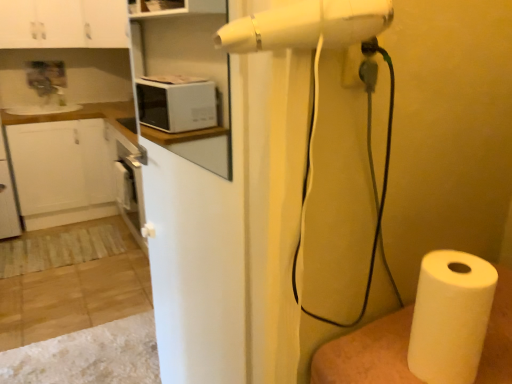
Question: From a real-world perspective, is white matte countertop at left positioned over white paper at lower right based on gravity?

Choices:
 (A) yes
 (B) no

Answer: (B)

Question: Is white matte countertop at left surrounding white paper at lower right?

Choices:
 (A) no
 (B) yes

Answer: (A)

Question: Is white matte countertop at left further to the viewer compared to white paper at lower right?

Choices:
 (A) no
 (B) yes

Answer: (B)

Question: Is white matte countertop at left closer to the viewer compared to white paper at lower right?

Choices:
 (A) yes
 (B) no

Answer: (B)

Question: Considering the relative sizes of white matte countertop at left and white paper at lower right in the image provided, is white matte countertop at left wider than white paper at lower right?

Choices:
 (A) no
 (B) yes

Answer: (A)

Question: Can you confirm if white matte countertop at left is taller than white paper at lower right?

Choices:
 (A) no
 (B) yes

Answer: (B)

Question: Is white matte countertop at left bigger than white glossy cabinet at upper left, which is the first cabinetry in right-to-left order?

Choices:
 (A) yes
 (B) no

Answer: (A)

Question: Could you tell me if white matte countertop at left is facing white glossy cabinet at upper left, arranged as the 2th cabinetry when viewed from the left?

Choices:
 (A) no
 (B) yes

Answer: (A)

Question: Is white matte countertop at left facing away from white glossy cabinet at upper left, arranged as the 2th cabinetry when viewed from the left?

Choices:
 (A) no
 (B) yes

Answer: (A)

Question: Can you confirm if white matte countertop at left is shorter than white glossy cabinet at upper left, which is the first cabinetry in right-to-left order?

Choices:
 (A) no
 (B) yes

Answer: (A)

Question: Is white matte countertop at left taller than white glossy cabinet at upper left, arranged as the 2th cabinetry when viewed from the left?

Choices:
 (A) yes
 (B) no

Answer: (A)

Question: From the image's perspective, is white matte countertop at left located beneath white glossy cabinet at upper left, which is the first cabinetry in right-to-left order?

Choices:
 (A) yes
 (B) no

Answer: (A)

Question: Does white paper at lower right have a lesser width compared to white matte microwave at upper left?

Choices:
 (A) no
 (B) yes

Answer: (A)